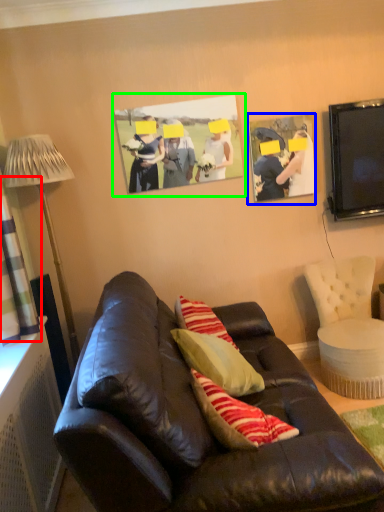
Question: Estimate the real-world distances between objects in this image. Which object is closer to curtain (highlighted by a red box), picture frame (highlighted by a blue box) or picture frame (highlighted by a green box)?

Choices:
 (A) picture frame
 (B) picture frame

Answer: (B)